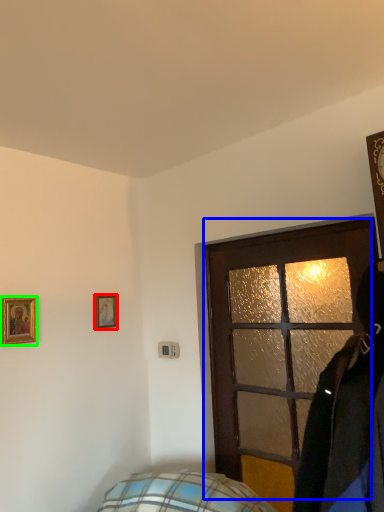
Question: Which object is the farthest from picture frame (highlighted by a red box)? Choose among these: door (highlighted by a blue box) or picture frame (highlighted by a green box).

Choices:
 (A) door
 (B) picture frame

Answer: (A)